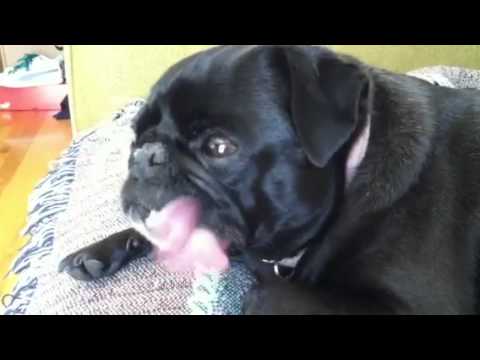
The height and width of the screenshot is (360, 480). What are the coordinates of `wall` in the screenshot? It's located at pyautogui.click(x=137, y=66).